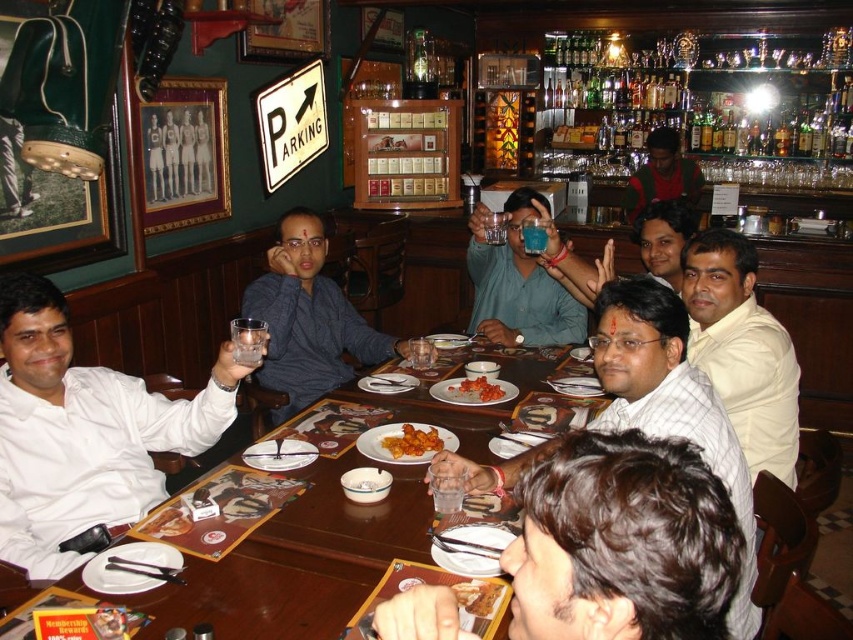
Question: Estimate the real-world distances between objects in this image. Which object is farther from the translucent plastic cup at center?

Choices:
 (A) white glossy shirt at left
 (B) tomato sauce pasta at center
 (C) red shirt at bar right

Answer: (C)

Question: Which of the following is the closest to the observer?

Choices:
 (A) (546, 241)
 (B) (730, 625)
 (C) (219, 572)
 (D) (479, 397)

Answer: (C)

Question: Is wooden table at center wider than matte blue glass at center?

Choices:
 (A) yes
 (B) no

Answer: (A)

Question: Is white shirt at center behind red shirt at bar right?

Choices:
 (A) yes
 (B) no

Answer: (B)

Question: Can you confirm if matte blue glass at center is wider than golden crispy pastry at center?

Choices:
 (A) yes
 (B) no

Answer: (A)

Question: Among these objects, which one is farthest from the camera?

Choices:
 (A) dark blue shirt at center
 (B) white glossy shirt at left
 (C) white shirt at center

Answer: (A)